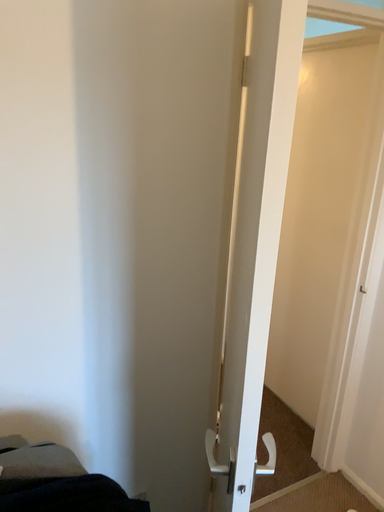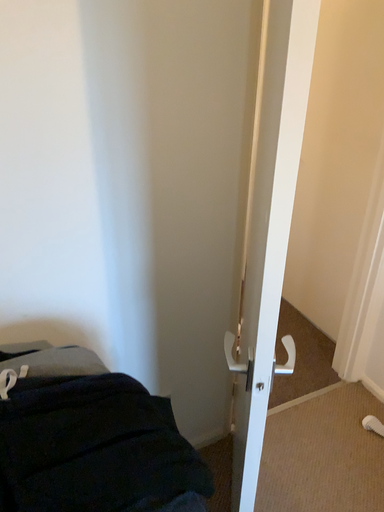
Question: How did the camera likely rotate when shooting the video?

Choices:
 (A) rotated upward
 (B) rotated downward

Answer: (B)